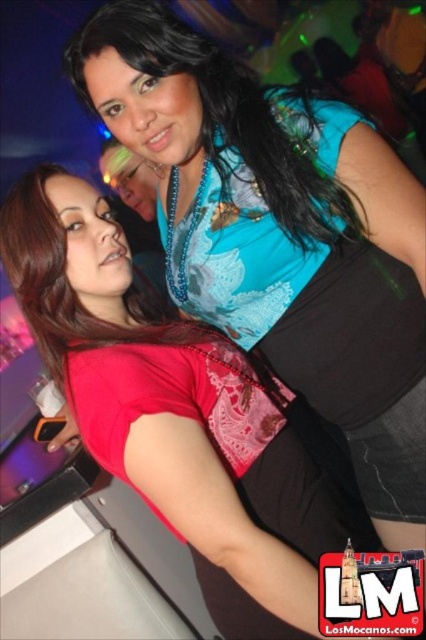
Question: Which object appears closest to the camera in this image?

Choices:
 (A) matte blue blouse at upper center
 (B) matte red shirt at upper left

Answer: (A)

Question: Which object is closer to the camera taking this photo?

Choices:
 (A) matte blue blouse at upper center
 (B) matte red shirt at upper left

Answer: (A)

Question: Which object is closer to the camera taking this photo?

Choices:
 (A) matte red shirt at upper left
 (B) matte blue blouse at upper center

Answer: (B)

Question: From the image, what is the correct spatial relationship of matte blue blouse at upper center in relation to matte red shirt at upper left?

Choices:
 (A) right
 (B) left

Answer: (A)

Question: From the image, what is the correct spatial relationship of matte blue blouse at upper center in relation to matte red shirt at upper left?

Choices:
 (A) below
 (B) above

Answer: (A)

Question: In this image, where is matte blue blouse at upper center located relative to matte red shirt at upper left?

Choices:
 (A) above
 (B) below

Answer: (B)